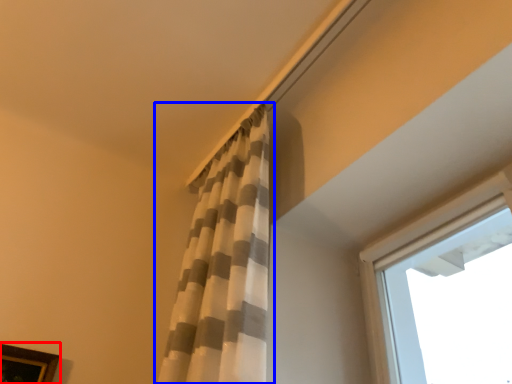
Question: Which point is further to the camera, picture frame (highlighted by a red box) or curtain (highlighted by a blue box)?

Choices:
 (A) picture frame
 (B) curtain

Answer: (A)